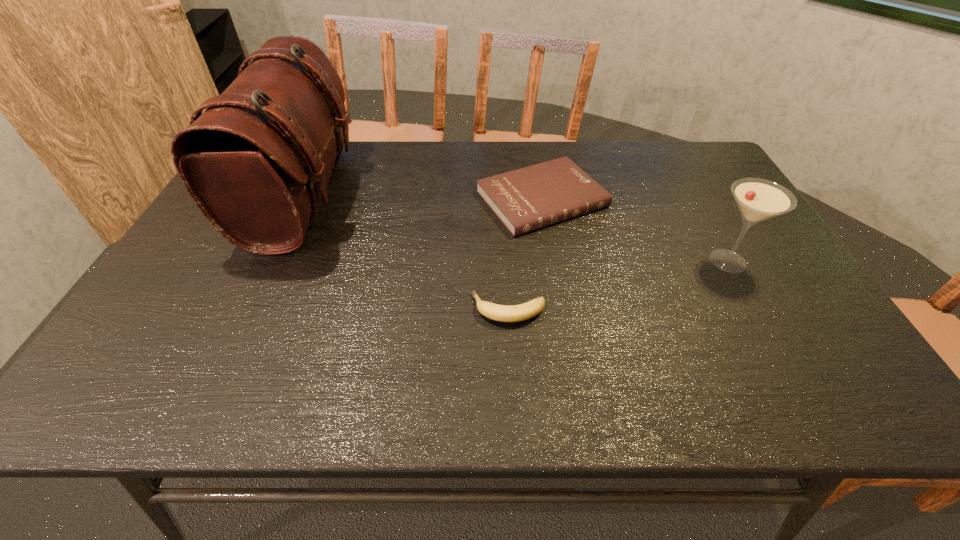
Identify the location of vacant area at the far right corner of the desktop. The height and width of the screenshot is (540, 960). point(668,143).

You are a GUI agent. You are given a task and a screenshot of the screen. Output one action in this format:
    pyautogui.click(x=<x>, y=<y>)
    Task: Click on the blank region between the tallest object and the nearest object
    The image size is (960, 540).
    Given the screenshot: What is the action you would take?
    pyautogui.click(x=405, y=252)

The width and height of the screenshot is (960, 540). Find the location of `unoccupied area between the nearest object and the hardback book`. unoccupied area between the nearest object and the hardback book is located at coordinates coord(525,254).

Image resolution: width=960 pixels, height=540 pixels. Find the location of `free spot between the satchel and the nearest object`. free spot between the satchel and the nearest object is located at coordinates (405, 252).

At what (x,y) coordinates should I click in order to perform the action: click on free space between the hardback book and the nearest object. Please return your answer as a coordinate pair (x, y). Looking at the image, I should click on (525, 254).

Identify the location of free spot between the hardback book and the third shortest object. The height and width of the screenshot is (540, 960). (635, 230).

This screenshot has width=960, height=540. I want to click on vacant area between the hardback book and the leftmost object, so click(422, 198).

The width and height of the screenshot is (960, 540). I want to click on free space between the hardback book and the nearest object, so click(x=525, y=254).

I want to click on vacant space that is in between the hardback book and the nearest object, so click(525, 254).

I want to click on the second closest object to the banana, so click(x=256, y=161).